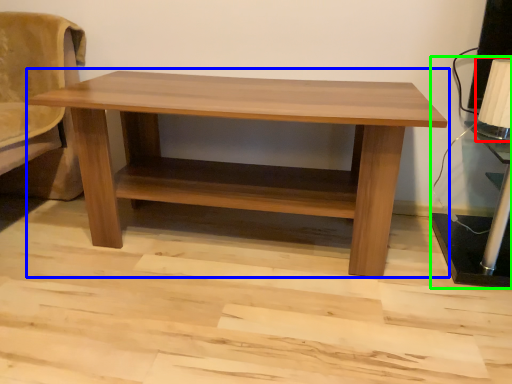
Question: Which object is positioned closest to table lamp (highlighted by a red box)? Select from table (highlighted by a blue box) and table lamp (highlighted by a green box).

Choices:
 (A) table
 (B) table lamp

Answer: (B)